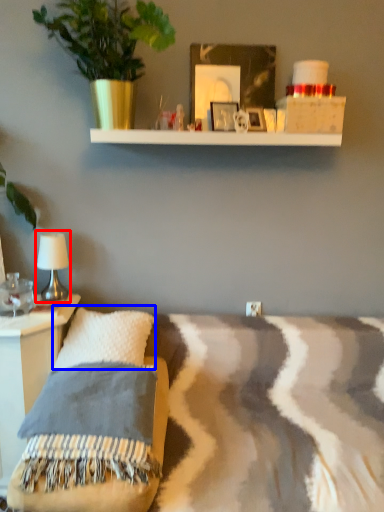
Question: Which object appears farthest to the camera in this image, table lamp (highlighted by a red box) or pillow (highlighted by a blue box)?

Choices:
 (A) table lamp
 (B) pillow

Answer: (A)